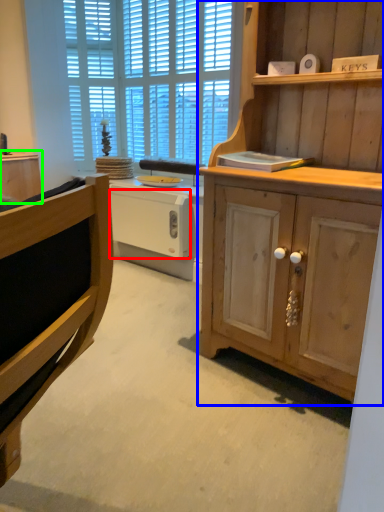
Question: Which object is the closest to the drawer (highlighted by a red box)? Choose among these: cabinetry (highlighted by a blue box) or cabinetry (highlighted by a green box).

Choices:
 (A) cabinetry
 (B) cabinetry

Answer: (B)